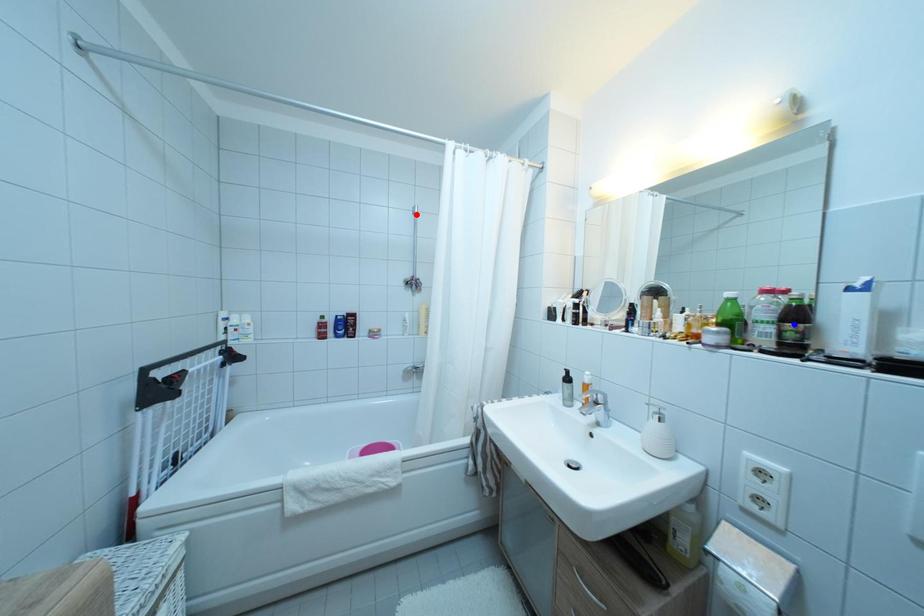
Question: Which of the two points in the image is closer to the camera?

Choices:
 (A) Blue point is closer.
 (B) Red point is closer.

Answer: (A)